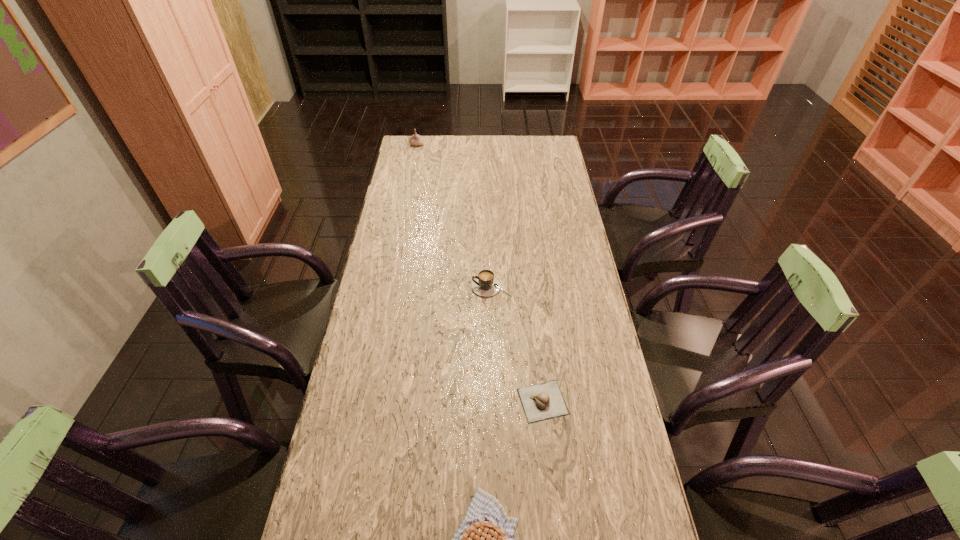
Image resolution: width=960 pixels, height=540 pixels. Identify the location of the farther garlic. tap(415, 139).

Where is `the tallest object`? This screenshot has width=960, height=540. the tallest object is located at coordinates (415, 139).

In order to click on the third shortest object in this screenshot , I will do `click(485, 284)`.

Identify the location of cappuccino. The width and height of the screenshot is (960, 540). (485, 284).

The width and height of the screenshot is (960, 540). Identify the location of the shorter garlic. (544, 401).

Identify the location of the nearer garlic. This screenshot has height=540, width=960. (544, 401).

Identify the location of free space located on the right of the tallest object. (492, 145).

I want to click on free point located 0.260m with the handle on the side of the second tallest object, so click(396, 287).

This screenshot has width=960, height=540. Identify the location of vacant space located with the handle on the side of the second tallest object. (383, 287).

This screenshot has height=540, width=960. In order to click on vacant region located with the handle on the side of the second tallest object in this screenshot , I will do `click(410, 287)`.